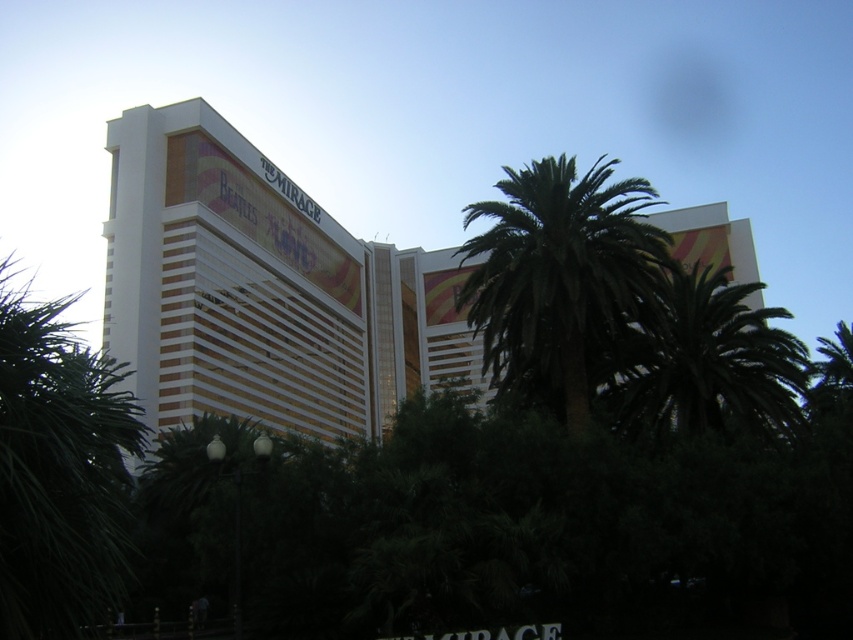
Between green leafy palm at left and green leafy palm at center, which one appears on the left side from the viewer's perspective?

green leafy palm at left is more to the left.

Does green leafy palm at left appear over green leafy palm at center?

Actually, green leafy palm at left is below green leafy palm at center.

Is point (83, 408) positioned before point (619, 246)?

Yes, point (83, 408) is closer to viewer.

You are a GUI agent. You are given a task and a screenshot of the screen. Output one action in this format:
    pyautogui.click(x=<x>, y=<y>)
    Task: Click on the green leafy palm at left
    
    Given the screenshot: What is the action you would take?
    pyautogui.click(x=59, y=472)

Is white glossy building at center positioned in front of green leafy palm at left?

No, it is behind green leafy palm at left.

Describe the element at coordinates (264, 291) in the screenshot. The height and width of the screenshot is (640, 853). I see `white glossy building at center` at that location.

Locate an element on the screen. The width and height of the screenshot is (853, 640). white glossy building at center is located at coordinates (264, 291).

What do you see at coordinates (561, 280) in the screenshot?
I see `green leafy palm at center` at bounding box center [561, 280].

Does green leafy palm at center come behind green leafy palm tree at center?

No, green leafy palm at center is in front of green leafy palm tree at center.

Who is more forward, (519,180) or (645,380)?

Point (519,180) is in front.

In order to click on green leafy palm at center in this screenshot , I will do `click(561, 280)`.